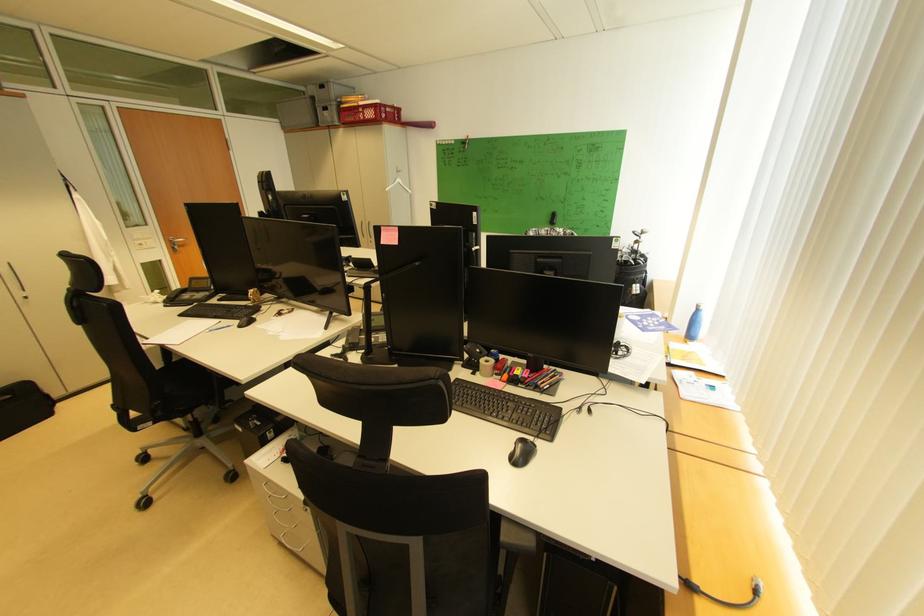
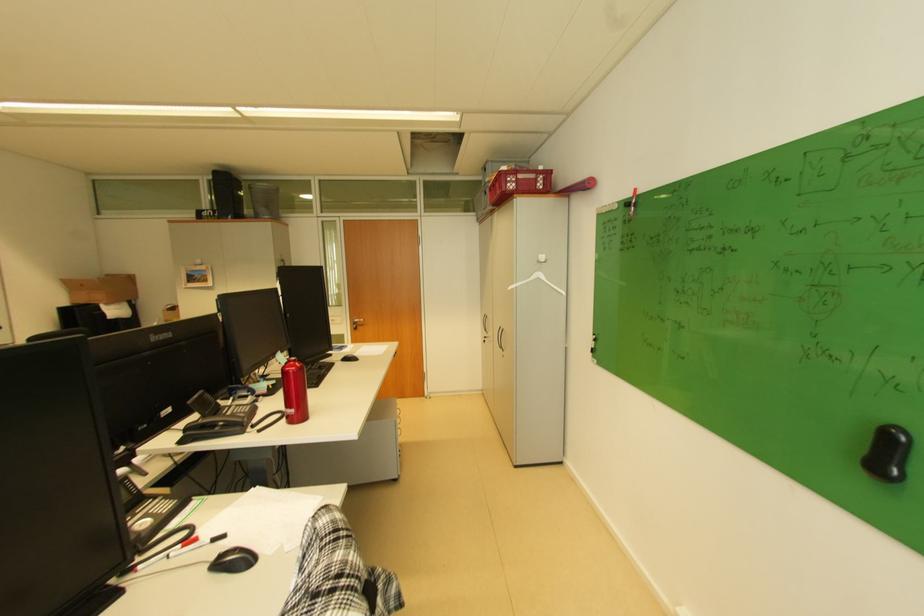
Locate, in the second image, the point that corresponds to point (396, 111) in the first image.

(529, 177)